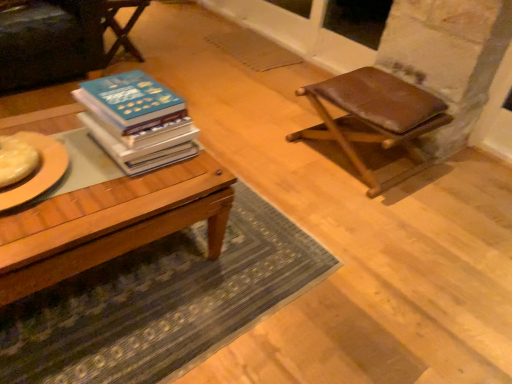
Locate an element on the screen. The height and width of the screenshot is (384, 512). free location in front of hardcover books at center is located at coordinates (113, 193).